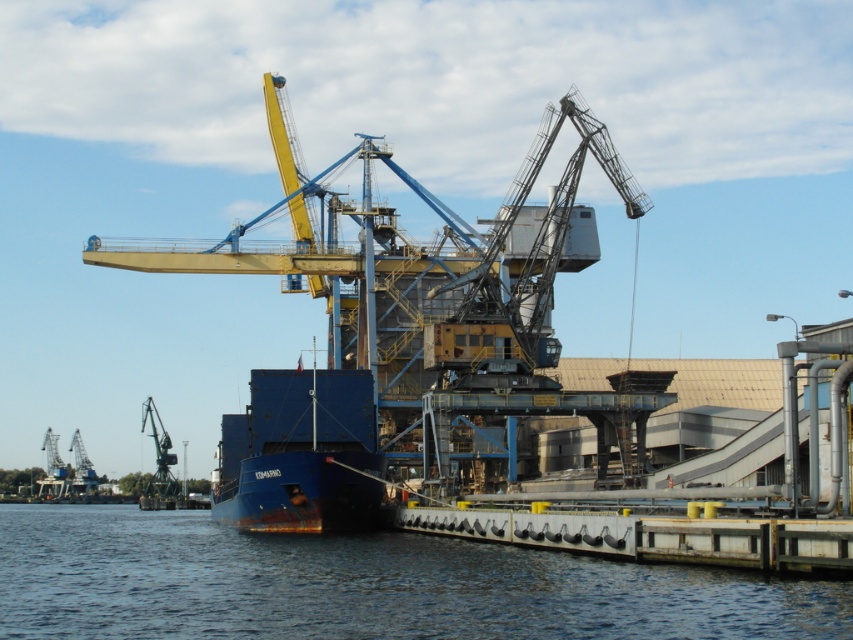
You are a crane operator standing on the deck of the cargo ship KOMARNO. You need to lower a heavy container into the water. Can you safely lower it using the yellow metallic crane at center without it hitting the blue water at lower left?

The yellow metallic crane at center is much taller than the blue water at lower left, so yes, you can safely lower the container using the yellow metallic crane at center without it hitting the blue water at lower left.

From the picture: You are a port supervisor and need to ensure that the blue water at lower left and the blue matte container ship at center are visible in the surveillance camera feed. Given their sizes, which one will occupy more of the camera frame?

The blue water at lower left has a larger size compared to the blue matte container ship at center, so it will occupy more of the camera frame.

You are a crane operator standing on the deck of the blue matte container ship at center. You need to lower a heavy container onto the dock. The yellow metallic crane at center is in your line of sight. Can you safely lower the container without hitting the crane?

The yellow metallic crane at center is further to the viewer than the blue matte container ship at center, meaning it is closer to you. Therefore, lowering the container might risk collision with the crane. You should adjust your path to avoid the crane.